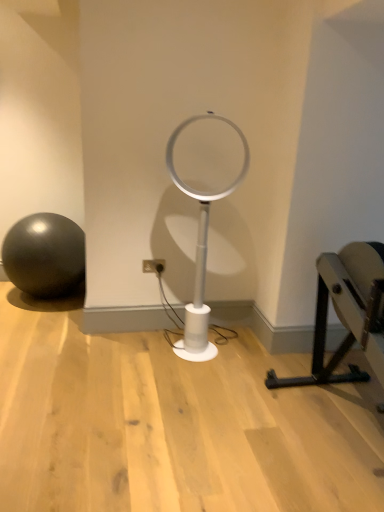
The width and height of the screenshot is (384, 512). What are the coordinates of `free spot to the left of black metal bench at right` in the screenshot? It's located at (206, 422).